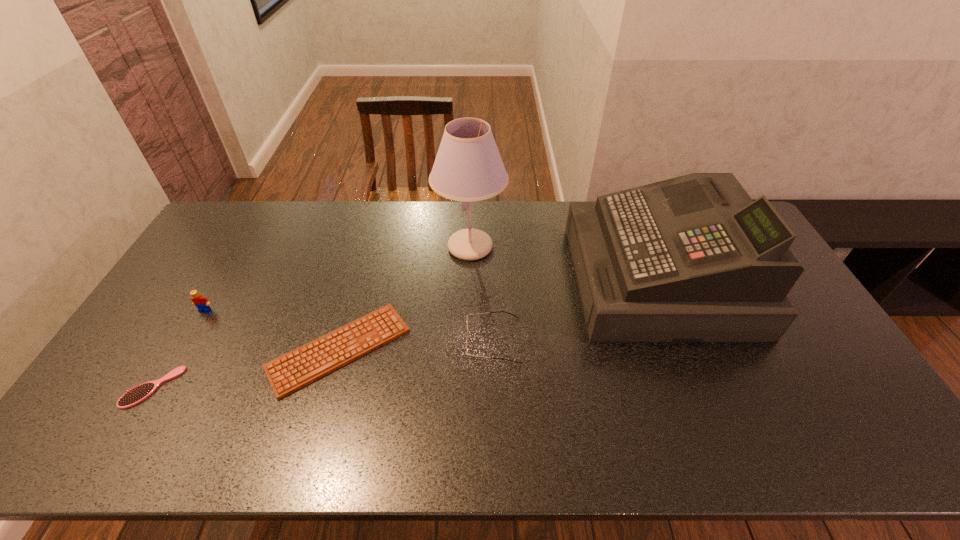
Identify the location of free spot located on the front-facing side of the fifth shortest object. Image resolution: width=960 pixels, height=540 pixels. (458, 279).

Identify the location of vacant space located 0.070m on the front-facing side of the fifth shortest object. Image resolution: width=960 pixels, height=540 pixels. (x=554, y=279).

Locate an element on the screen. blank space located 0.140m on the front-facing side of the fourth shortest object is located at coordinates (181, 351).

You are a GUI agent. You are given a task and a screenshot of the screen. Output one action in this format:
    pyautogui.click(x=<x>, y=<y>)
    Task: Click on the blank space located 0.050m through the lenses of the fourth tallest object
    
    Given the screenshot: What is the action you would take?
    pyautogui.click(x=448, y=340)

You are a GUI agent. You are given a task and a screenshot of the screen. Output one action in this format:
    pyautogui.click(x=<x>, y=<y>)
    Task: Click on the free point located 0.150m through the lenses of the fourth tallest object
    This screenshot has height=540, width=960.
    Given the screenshot: What is the action you would take?
    pyautogui.click(x=413, y=340)

Locate an element on the screen. This screenshot has width=960, height=540. vacant space located 0.120m through the lenses of the fourth tallest object is located at coordinates (423, 340).

Where is `blank space located 0.340m on the right of the hairbrush`? This screenshot has height=540, width=960. blank space located 0.340m on the right of the hairbrush is located at coordinates (x=308, y=387).

The height and width of the screenshot is (540, 960). In order to click on vacant space located 0.250m on the right of the shortest object in this screenshot , I will do `click(497, 349)`.

Where is `lampshade that is positioned at the far edge`? lampshade that is positioned at the far edge is located at coordinates (468, 167).

In order to click on cash register that is positioned at the far edge in this screenshot , I will do `click(690, 259)`.